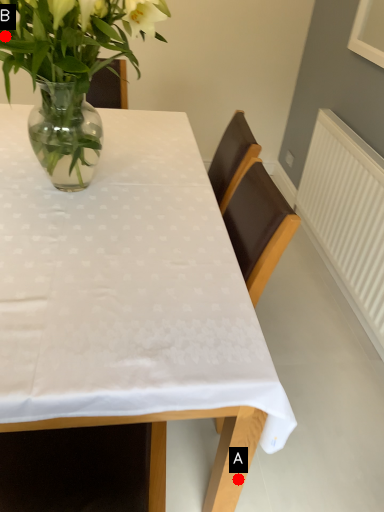
Question: Two points are circled on the image, labeled by A and B beside each circle. Which point is farther to the camera?

Choices:
 (A) A is further
 (B) B is further

Answer: (B)